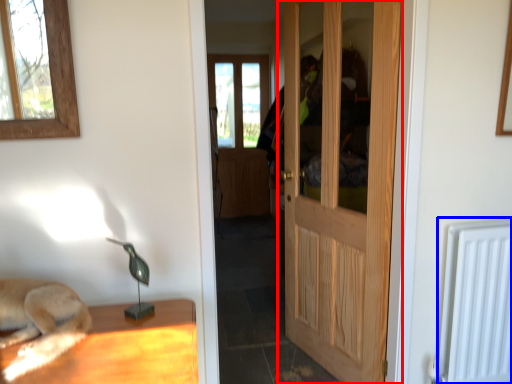
Question: Which of the following is the closest to the observer, door (highlighted by a red box) or radiator (highlighted by a blue box)?

Choices:
 (A) door
 (B) radiator

Answer: (A)